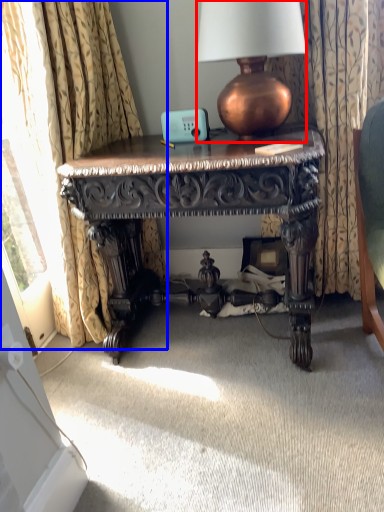
Question: Which object is further to the camera taking this photo, lamp (highlighted by a red box) or curtain (highlighted by a blue box)?

Choices:
 (A) lamp
 (B) curtain

Answer: (A)